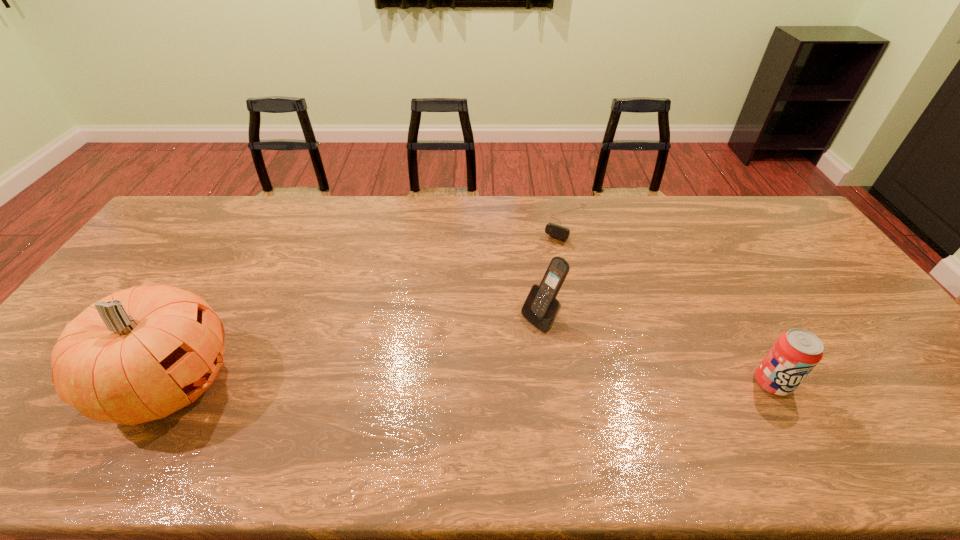
Identify which object is located as the nearest to the rightmost object. Please provide its 2D coordinates. Your answer should be formatted as a tuple, i.e. [(x, y)], where the tuple contains the x and y coordinates of a point satisfying the conditions above.

[(541, 307)]